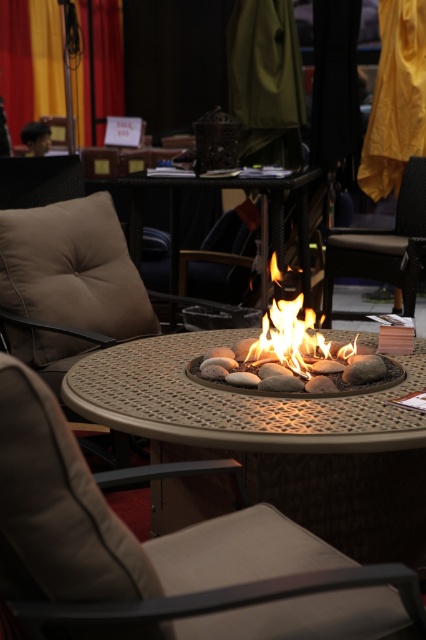
Question: From the image, what is the correct spatial relationship of black leather armchair at center in relation to metallic fire pit at center?

Choices:
 (A) left
 (B) right

Answer: (B)

Question: Can you confirm if black leather armchair at center is thinner than flamematerial/texture at center?

Choices:
 (A) no
 (B) yes

Answer: (A)

Question: Which of the following is the closest to the observer?

Choices:
 (A) (278, 611)
 (B) (363, 253)

Answer: (A)

Question: Can you confirm if black leather armchair at center is wider than metallic fire pit at center?

Choices:
 (A) yes
 (B) no

Answer: (B)

Question: Which object is the farthest from the metallic fire pit at center?

Choices:
 (A) black leather armchair at center
 (B) beige fabric armchair at center

Answer: (B)

Question: Which point appears farthest from the camera in this image?

Choices:
 (A) (393, 589)
 (B) (262, 250)
 (C) (370, 262)
 (D) (278, 340)

Answer: (B)